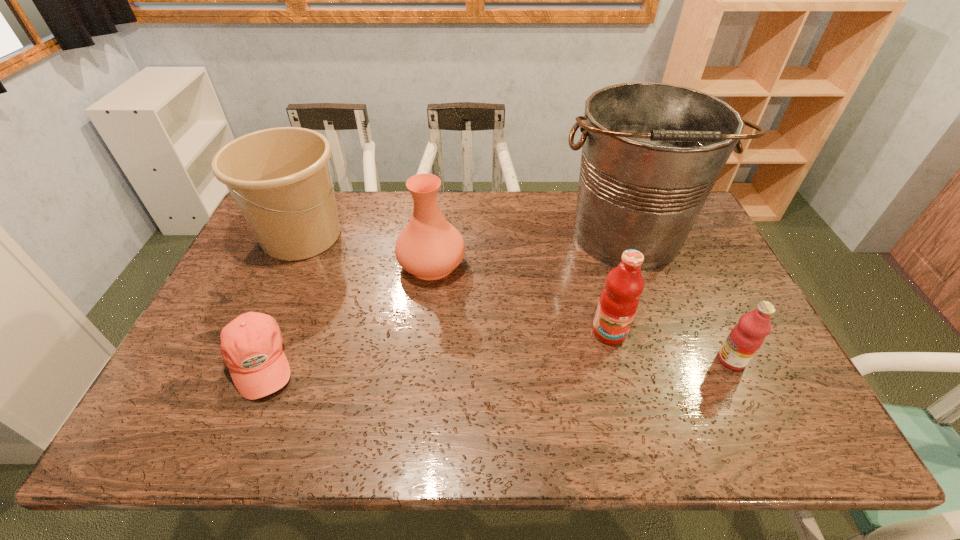
Where is `fruit juice present at the right edge`? The image size is (960, 540). fruit juice present at the right edge is located at coordinates (744, 340).

Image resolution: width=960 pixels, height=540 pixels. In order to click on object that is at the far left corner in this screenshot , I will do `click(280, 178)`.

Identify the location of object present at the far right corner. The width and height of the screenshot is (960, 540). (651, 152).

Image resolution: width=960 pixels, height=540 pixels. Find the location of `blank space at the far edge of the desktop`. blank space at the far edge of the desktop is located at coordinates (560, 206).

Where is `vacant space at the near edge of the desktop`? vacant space at the near edge of the desktop is located at coordinates pyautogui.click(x=521, y=414).

At what (x,y) coordinates should I click in order to perform the action: click on vacant region at the left edge of the desktop. Please return your answer as a coordinate pair (x, y). The height and width of the screenshot is (540, 960). Looking at the image, I should click on (259, 266).

Where is `vacant point at the right edge`? vacant point at the right edge is located at coordinates click(x=710, y=286).

What are the coordinates of `blank space at the near right corner` in the screenshot? It's located at (765, 421).

You are a GUI agent. You are given a task and a screenshot of the screen. Output one action in this format:
    pyautogui.click(x=<x>, y=<y>)
    Task: Click on the free space between the vase and the farther fruit juice
    The width and height of the screenshot is (960, 540).
    Given the screenshot: What is the action you would take?
    pyautogui.click(x=520, y=298)

At what (x,y) coordinates should I click in order to perform the action: click on unoccupied area between the farther fruit juice and the shorter fruit juice. Please return your answer as a coordinate pair (x, y). The width and height of the screenshot is (960, 540). Looking at the image, I should click on (670, 346).